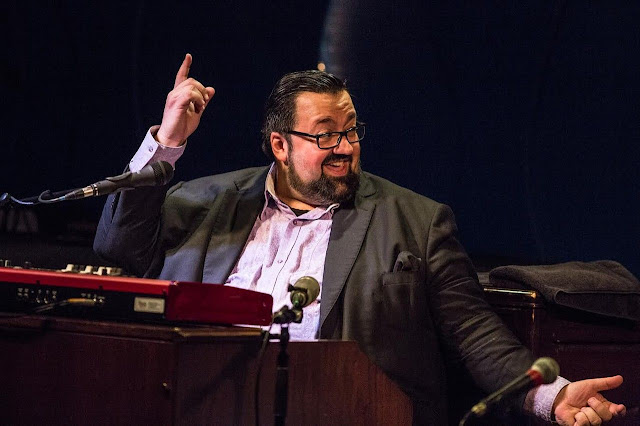
Locate an element on the screen. towel is located at coordinates pos(571,287).